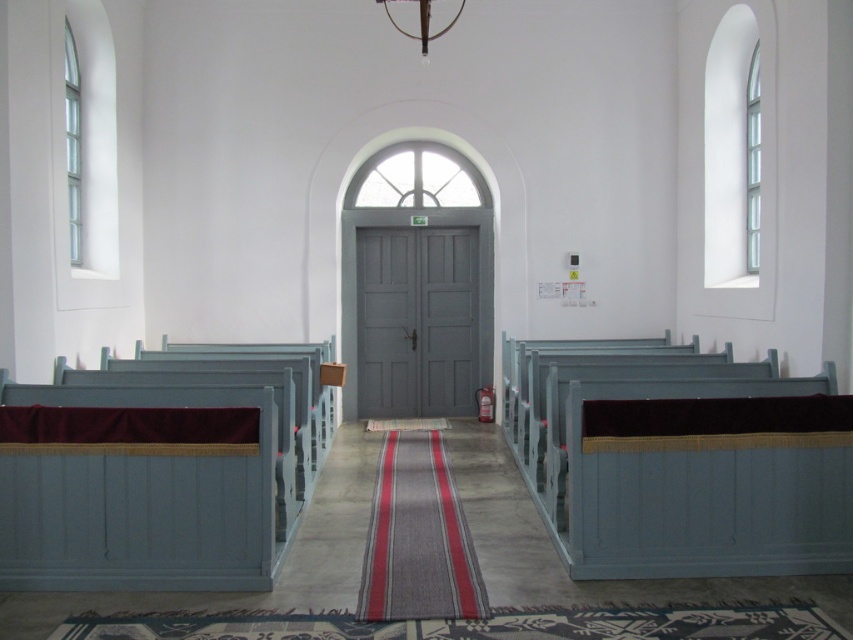
Question: Does matte blue wood bench at left have a greater width compared to matte blue wood church bench at right?

Choices:
 (A) yes
 (B) no

Answer: (B)

Question: Does matte blue wood bench at left have a larger size compared to matte blue wood church bench at right?

Choices:
 (A) no
 (B) yes

Answer: (A)

Question: Which point is farther to the camera?

Choices:
 (A) matte blue wood bench at left
 (B) matte blue wood church bench at right

Answer: (B)

Question: Which object is closer to the camera taking this photo?

Choices:
 (A) matte blue wood church bench at right
 (B) matte blue wood bench at left

Answer: (B)

Question: Can you confirm if matte blue wood bench at left is positioned to the left of matte blue wood church bench at right?

Choices:
 (A) no
 (B) yes

Answer: (B)